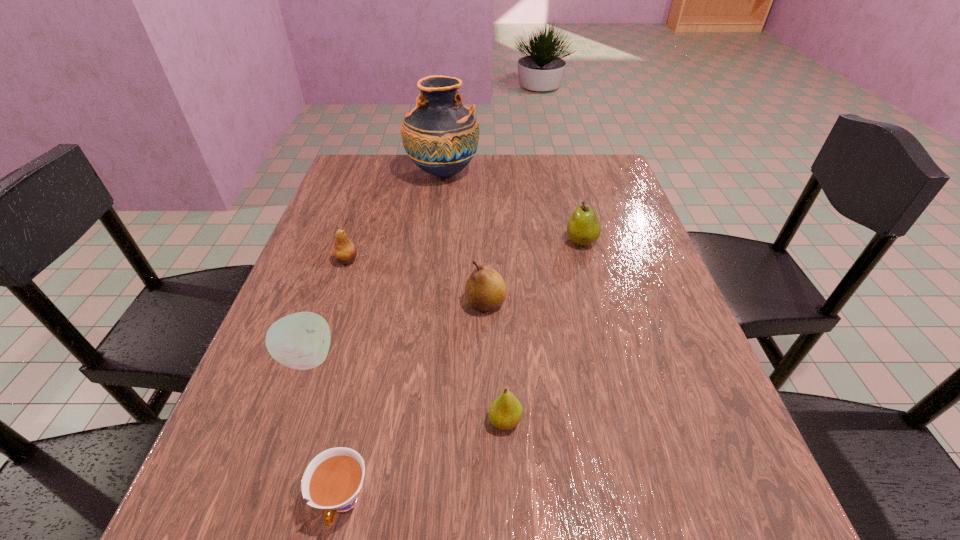
You are a GUI agent. You are given a task and a screenshot of the screen. Output one action in this format:
    pyautogui.click(x=<x>, y=<y>)
    Task: Click on the vacant space that is in between the third nearest pear and the teacup
    Image resolution: width=960 pixels, height=540 pixels.
    Given the screenshot: What is the action you would take?
    pyautogui.click(x=345, y=381)

At what (x,y) coordinates should I click in order to perform the action: click on vacant point located between the third nearest object and the nearest object. Please return your answer as a coordinate pair (x, y). The height and width of the screenshot is (540, 960). Looking at the image, I should click on (325, 430).

Find the location of a particular element. The height and width of the screenshot is (540, 960). empty space between the fifth farthest object and the nearest object is located at coordinates (325, 430).

Identify the location of vacant space in between the farthest pear and the tallest object. (513, 207).

Find the location of a particular element. The width and height of the screenshot is (960, 540). free spot between the tallest object and the second farthest pear is located at coordinates (395, 217).

You are a GUI agent. You are given a task and a screenshot of the screen. Output one action in this format:
    pyautogui.click(x=<x>, y=<y>)
    Task: Click on the vacant space in between the fifth nearest object and the nearest pear
    The height and width of the screenshot is (540, 960).
    Given the screenshot: What is the action you would take?
    point(426,341)

Locate an element on the screen. vacant area that lies between the leftmost pear and the third farthest pear is located at coordinates (416, 282).

Image resolution: width=960 pixels, height=540 pixels. What are the coordinates of `empty space between the third nearest object and the nearest pear` in the screenshot? It's located at (406, 389).

Find the location of a particular element. The height and width of the screenshot is (540, 960). free space between the second farthest pear and the nearest pear is located at coordinates (426, 341).

Locate which object ranks sixth in proximity to the leftmost pear. Please provide its 2D coordinates. Your answer should be formatted as a tuple, i.e. [(x, y)], where the tuple contains the x and y coordinates of a point satisfying the conditions above.

[(583, 228)]